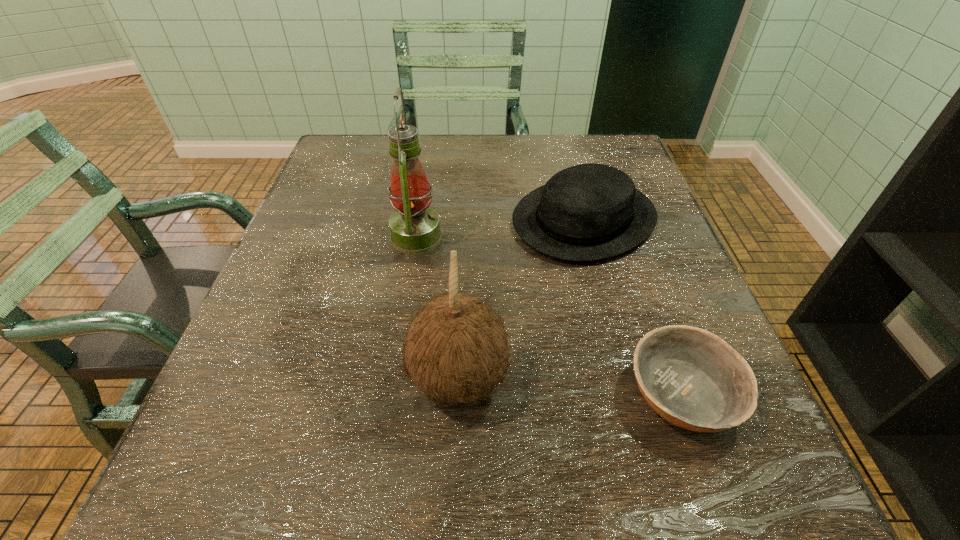
The width and height of the screenshot is (960, 540). Find the location of `vacant space at the far edge of the desktop`. vacant space at the far edge of the desktop is located at coordinates (517, 141).

You are a GUI agent. You are given a task and a screenshot of the screen. Output one action in this format:
    pyautogui.click(x=<x>, y=<y>)
    Task: Click on the vacant space at the near edge of the desktop
    This screenshot has height=540, width=960.
    Given the screenshot: What is the action you would take?
    pyautogui.click(x=612, y=502)

In the image, there is a desktop. At what (x,y) coordinates should I click in order to perform the action: click on vacant space at the left edge. Please return your answer as a coordinate pair (x, y). Looking at the image, I should click on (340, 197).

In the image, there is a desktop. At what (x,y) coordinates should I click in order to perform the action: click on blank space at the right edge. Please return your answer as a coordinate pair (x, y). The height and width of the screenshot is (540, 960). Looking at the image, I should click on (726, 434).

This screenshot has height=540, width=960. In the image, there is a desktop. Identify the location of vacant space at the far left corner. (369, 147).

The height and width of the screenshot is (540, 960). Identify the location of vacant area that lies between the oil lamp and the shortest object. (549, 315).

Identify the location of free spot between the third tallest object and the tallest object. (500, 228).

Where is `vacant space that is in between the shortest object and the coconut`? vacant space that is in between the shortest object and the coconut is located at coordinates (570, 387).

Identify the location of free space between the oil lamp and the bowl. (549, 315).

In order to click on free space between the oil lamp and the fedora in this screenshot , I will do `click(500, 228)`.